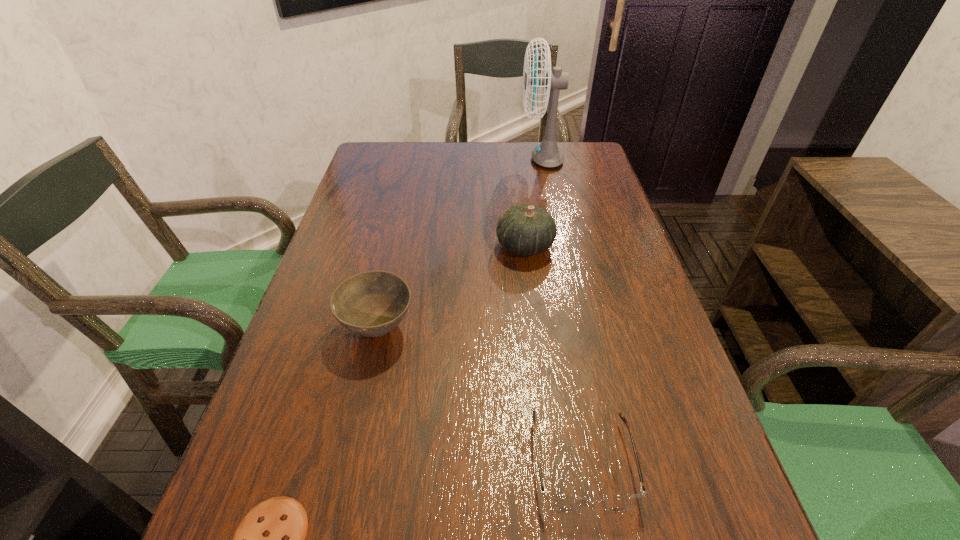
Locate an element on the screen. vacant region at the far right corner is located at coordinates (590, 153).

Locate an element on the screen. vacant space in between the spectacles and the third tallest object is located at coordinates 480,395.

At what (x,y) coordinates should I click in order to perform the action: click on free space between the bowl and the second shortest object. Please return your answer as a coordinate pair (x, y). Looking at the image, I should click on (480, 395).

Identify the location of vacant area that lies between the fourth nearest object and the bowl. (451, 287).

Find the location of a particular element. free spot between the fan and the second tallest object is located at coordinates (x=533, y=202).

Locate an element on the screen. vacant area between the tallest object and the spectacles is located at coordinates (562, 310).

Locate an element on the screen. This screenshot has width=960, height=540. object that can be found as the fourth closest to the fan is located at coordinates (270, 539).

Where is `object identified as the fourth closest to the bowl`? The width and height of the screenshot is (960, 540). object identified as the fourth closest to the bowl is located at coordinates (547, 154).

Where is `free location that satisfies the following two spatial constraints: 1. on the front-facing side of the tallest object; 2. on the front-facing side of the fourth tallest object`? free location that satisfies the following two spatial constraints: 1. on the front-facing side of the tallest object; 2. on the front-facing side of the fourth tallest object is located at coordinates (605, 462).